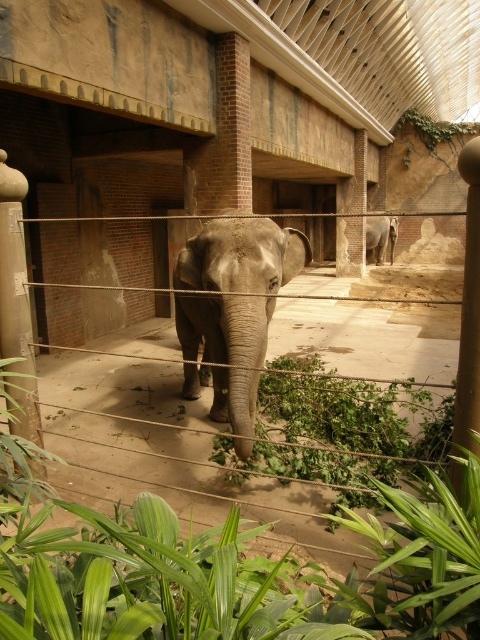
The image size is (480, 640). Describe the element at coordinates (339, 429) in the screenshot. I see `green leafy plant at center` at that location.

Which is below, green leafy plant at center or gray textured elephant at center?

Positioned lower is green leafy plant at center.

At what (x,y) coordinates should I click in order to perform the action: click on green leafy plant at center. Please return your answer as a coordinate pair (x, y). This screenshot has height=640, width=480. Looking at the image, I should click on pos(339,429).

Which is behind, point (393, 547) or point (242, 333)?

The point (242, 333) is more distant.

Does point (409, 524) come closer to viewer compared to point (228, 401)?

Yes.

Where is `green leafy plant at lower center`? This screenshot has height=640, width=480. green leafy plant at lower center is located at coordinates (422, 557).

Which of these two, green leafy plant at center or green leafy plant at lower center, stands taller?

With more height is green leafy plant at lower center.

Which is above, green leafy plant at center or green leafy plant at lower center?

green leafy plant at center is above.

Is point (276, 465) positioned in front of point (386, 550)?

No, (276, 465) is further to viewer.

Locate an element on the screen. The width and height of the screenshot is (480, 640). green leafy plant at center is located at coordinates (339, 429).